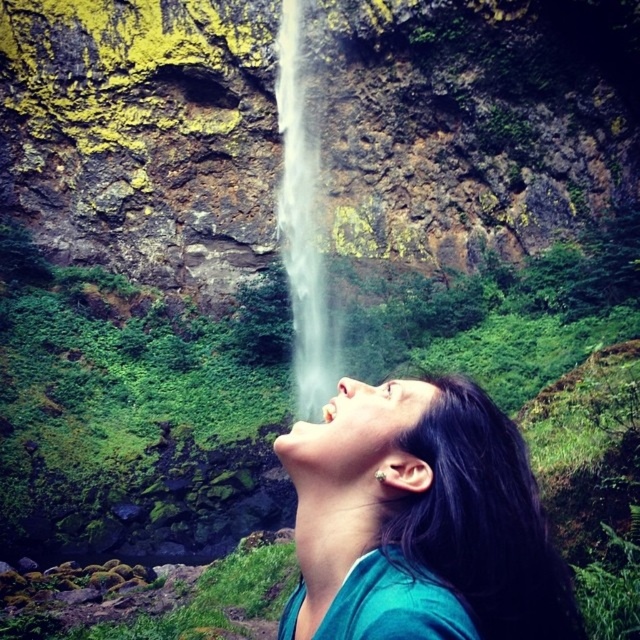
You are a photographer trying to capture the perfect shot of the teal fabric shirt at center. Where should you position your camera to ensure the shirt is in the center of your frame?

The teal fabric shirt at center is already positioned at the center of the image at point coordinates (422, 512), so the camera should be aligned to frame the shirt at that central point.

You are standing in front of the waterfall and see the woman in the teal top. Where is the teal fabric shirt at center located relative to the point marked at coordinates (422, 512)?

The point at coordinates (422, 512) marks the teal fabric shirt at center, so they are in the same location.